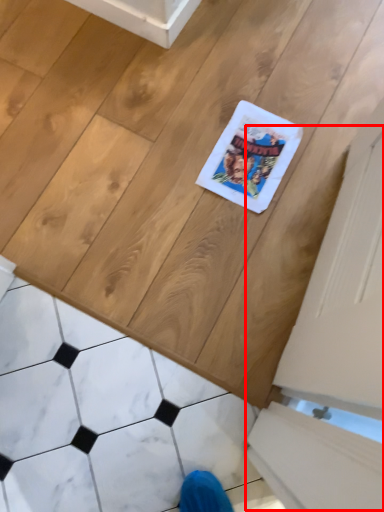
Question: From the image's perspective, what is the correct spatial positioning of screen door (annotated by the red box) in reference to marble?

Choices:
 (A) above
 (B) below

Answer: (A)